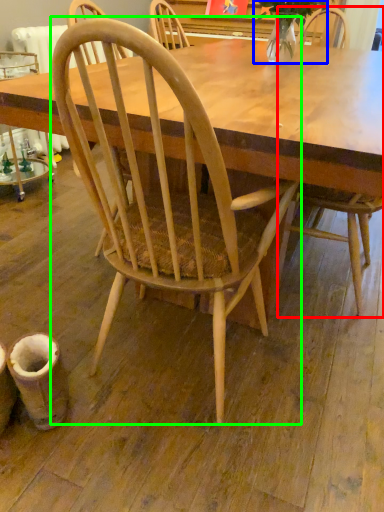
Question: Which object is the farthest from chair (highlighted by a red box)? Choose among these: plant (highlighted by a blue box) or chair (highlighted by a green box).

Choices:
 (A) plant
 (B) chair

Answer: (A)